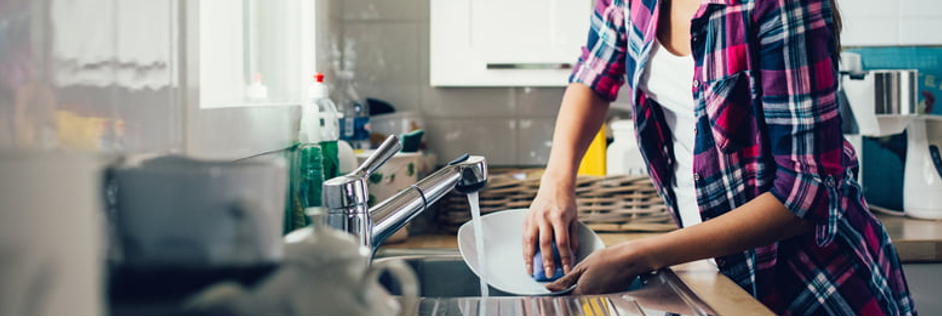
At what (x,y) coordinates should I click in order to perform the action: click on tap spray button. Please return your answer as a coordinate pair (x, y). Looking at the image, I should click on (460, 156).